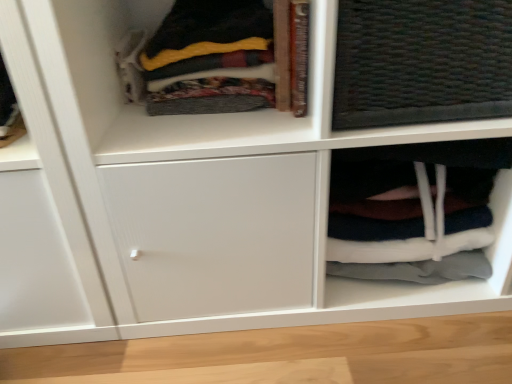
Question: Based on their positions, is white fabric at lower right located to the left or right of soft fleece blanket at upper left?

Choices:
 (A) left
 (B) right

Answer: (B)

Question: Is white fabric at lower right bigger or smaller than soft fleece blanket at upper left?

Choices:
 (A) big
 (B) small

Answer: (A)

Question: From a real-world perspective, is white fabric at lower right above or below soft fleece blanket at upper left?

Choices:
 (A) above
 (B) below

Answer: (B)

Question: Is point (237, 26) positioned closer to the camera than point (401, 157)?

Choices:
 (A) closer
 (B) farther

Answer: (A)

Question: Considering the positions of soft fleece blanket at upper left and white fabric at lower right in the image, is soft fleece blanket at upper left bigger or smaller than white fabric at lower right?

Choices:
 (A) small
 (B) big

Answer: (A)

Question: From a real-world perspective, is soft fleece blanket at upper left above or below white fabric at lower right?

Choices:
 (A) below
 (B) above

Answer: (B)

Question: Is soft fleece blanket at upper left in front of or behind white fabric at lower right in the image?

Choices:
 (A) front
 (B) behind

Answer: (A)